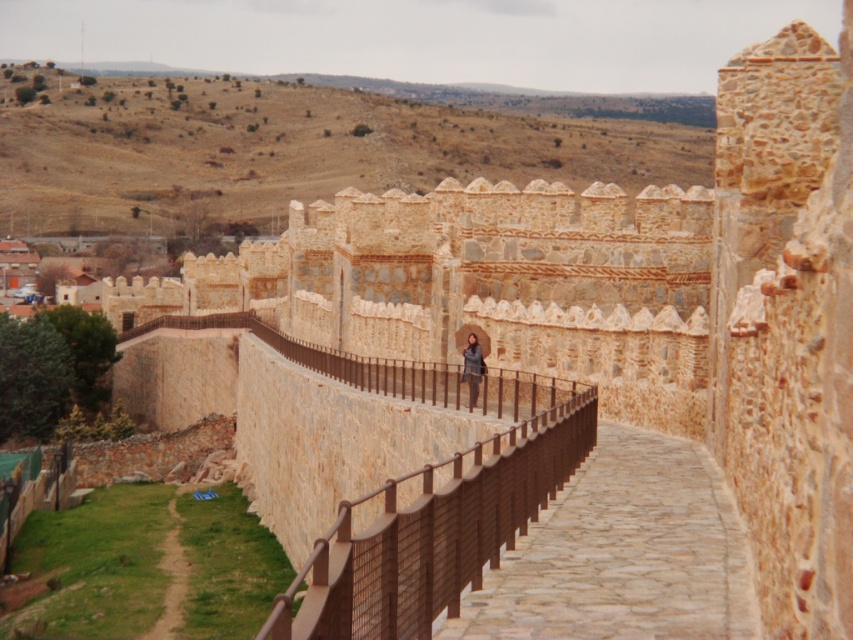
Between point (695, 493) and point (521, 515), which one is positioned behind?

Point (695, 493)

Which of these two, brown cobblestone path at center or brown metal/rail at center, stands taller?

brown metal/rail at center

Image resolution: width=853 pixels, height=640 pixels. What are the coordinates of `brown cobblestone path at center` in the screenshot? It's located at (624, 554).

This screenshot has height=640, width=853. Identify the location of brown cobblestone path at center. click(624, 554).

Between brown/dry grass at upper center and brown metal/rail at center, which one has less height?

brown metal/rail at center is shorter.

Is brown/dry grass at upper center further to the viewer compared to brown metal/rail at center?

Yes.

Where is `brown/dry grass at upper center`? This screenshot has width=853, height=640. brown/dry grass at upper center is located at coordinates (288, 152).

Who is higher up, brown metal/rail at center or dark gray leather jacket at center?

dark gray leather jacket at center

Can you confirm if brown metal/rail at center is wider than dark gray leather jacket at center?

Correct, the width of brown metal/rail at center exceeds that of dark gray leather jacket at center.

Who is more distant from viewer, [427,561] or [480,348]?

Point [480,348]

Where is `brown metal/rail at center`? brown metal/rail at center is located at coordinates point(432,532).